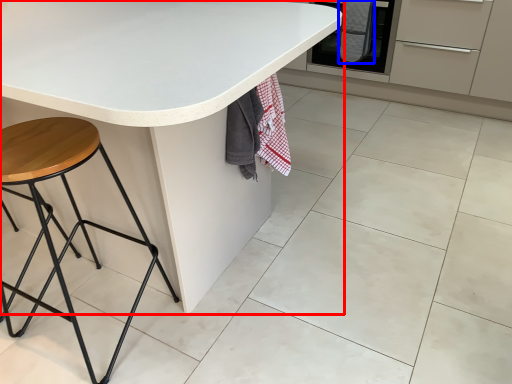
Question: Which of the following is the closest to the observer, table (highlighted by a red box) or blanket (highlighted by a blue box)?

Choices:
 (A) table
 (B) blanket

Answer: (A)